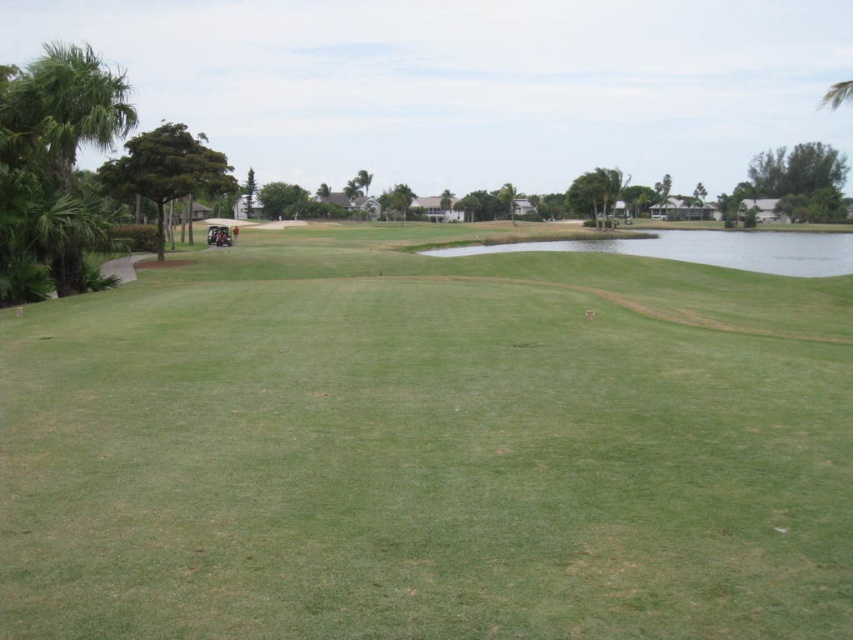
Question: Which of the following is the closest to the observer?

Choices:
 (A) (335, 230)
 (B) (7, 179)

Answer: (B)

Question: Is green grassy golf course at center to the left of green leafy palm tree at left from the viewer's perspective?

Choices:
 (A) no
 (B) yes

Answer: (A)

Question: From the image, what is the correct spatial relationship of green grassy golf course at center in relation to green leafy palm tree at left?

Choices:
 (A) right
 (B) left

Answer: (A)

Question: Which of the following is the farthest from the observer?

Choices:
 (A) (390, 506)
 (B) (119, 84)

Answer: (B)

Question: Can you confirm if green grassy golf course at center is wider than green leafy palm tree at left?

Choices:
 (A) yes
 (B) no

Answer: (B)